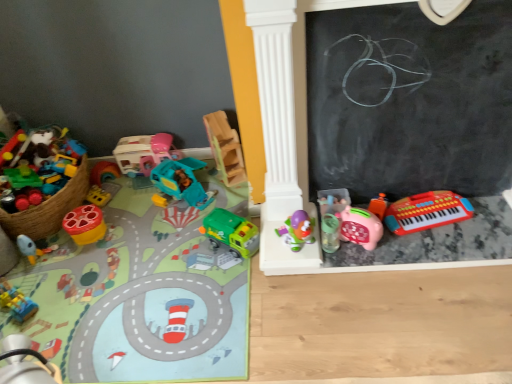
Question: In the image, is purple plastic toy at center, which is counted as the fourth toy, starting from the right, on the left side or the right side of wooden blocks at center, the sixth toy in the right-to-left sequence?

Choices:
 (A) right
 (B) left

Answer: (A)

Question: From the image's perspective, is purple plastic toy at center, the 9th toy in the left-to-right sequence, above or below wooden blocks at center, the sixth toy in the right-to-left sequence?

Choices:
 (A) below
 (B) above

Answer: (A)

Question: Which object is positioned farthest from the green plastic toy truck at center, placed as the eighth toy when sorted from left to right?

Choices:
 (A) purple plastic toy at center, the 9th toy in the left-to-right sequence
 (B) wooden blocks at center, the sixth toy in the right-to-left sequence
 (C) shiny plastic toy at left, arranged as the 3th toy when viewed from the left
 (D) matte plastic toy car at left, positioned as the 9th toy in right-to-left order
 (E) clear plastic water bottle at center-right, which ranks as the tenth toy in left-to-right order

Answer: (C)

Question: Which object is the closest to the teal plastic car at center, marked as the 7th toy in a right-to-left arrangement?

Choices:
 (A) rubberized plastic keyboard at lower right, the twelfth toy from the left
 (B) black chalkboard at right
 (C) green plastic toy truck at center, placed as the eighth toy when sorted from left to right
 (D) purple plastic toy at center, the 9th toy in the left-to-right sequence
 (E) matte plastic toy rocket at lower left, which is the 12th toy from right to left

Answer: (C)